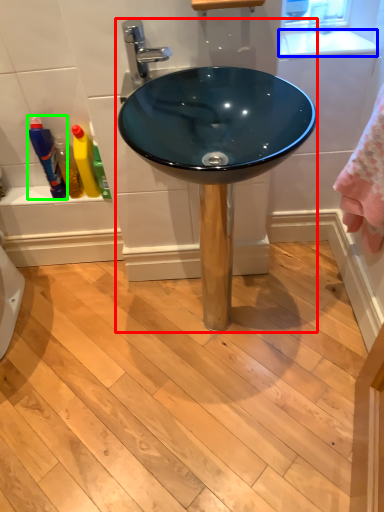
Question: Which object is positioned closest to sink (highlighted by a red box)? Select from counter top (highlighted by a blue box) and bottle (highlighted by a green box).

Choices:
 (A) counter top
 (B) bottle

Answer: (A)